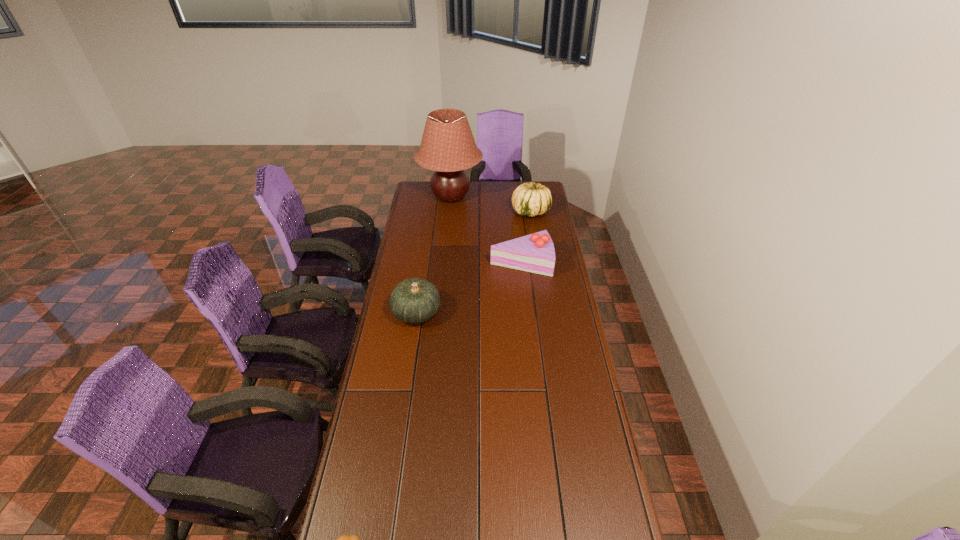
Where is `lampshade located at the left edge`? The width and height of the screenshot is (960, 540). lampshade located at the left edge is located at coordinates (448, 147).

Identify the location of gourd at the left edge. (x=415, y=300).

At what (x,y) coordinates should I click in order to perform the action: click on gourd at the right edge. Please return your answer as a coordinate pair (x, y). Image resolution: width=960 pixels, height=540 pixels. Looking at the image, I should click on (531, 199).

The width and height of the screenshot is (960, 540). Find the location of `cake located in the right edge section of the desktop`. cake located in the right edge section of the desktop is located at coordinates (535, 253).

You are a GUI agent. You are given a task and a screenshot of the screen. Output one action in this format:
    pyautogui.click(x=<x>, y=<y>)
    Task: Click on the object that is positioned at the far left corner
    The image size is (960, 540).
    Given the screenshot: What is the action you would take?
    pyautogui.click(x=448, y=147)

You are a GUI agent. You are given a task and a screenshot of the screen. Output one action in this format:
    pyautogui.click(x=<x>, y=<y>)
    Task: Click on the object that is at the far right corner
    
    Given the screenshot: What is the action you would take?
    pyautogui.click(x=531, y=199)

In order to click on vacant space at the left edge of the desktop in this screenshot , I will do `click(384, 362)`.

I want to click on vacant space at the right edge, so click(x=595, y=440).

In the image, there is a desktop. At what (x,y) coordinates should I click in order to perform the action: click on free space at the far left corner. Please return your answer as a coordinate pair (x, y). Looking at the image, I should click on (420, 184).

Where is `vacant space at the far right corner of the desktop`? Image resolution: width=960 pixels, height=540 pixels. vacant space at the far right corner of the desktop is located at coordinates (524, 183).